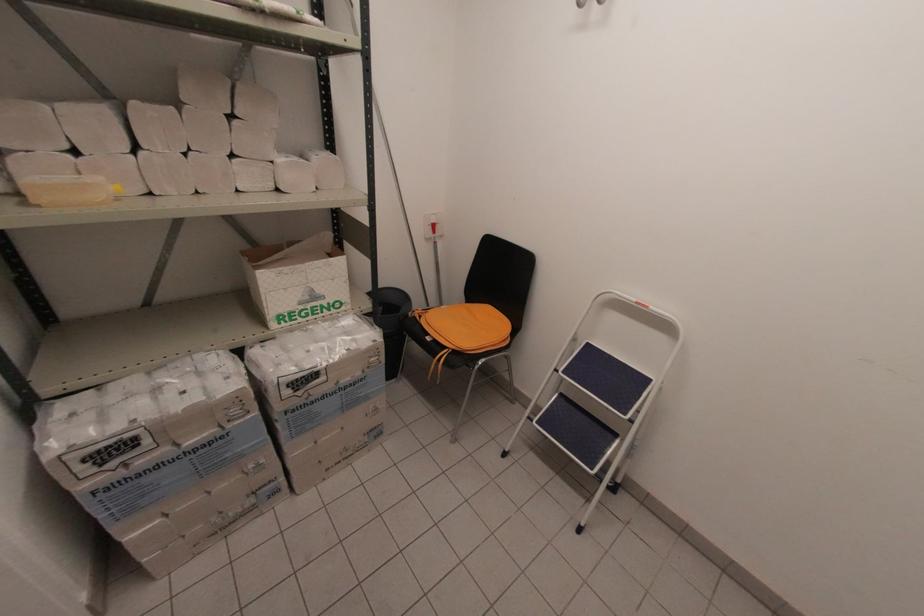
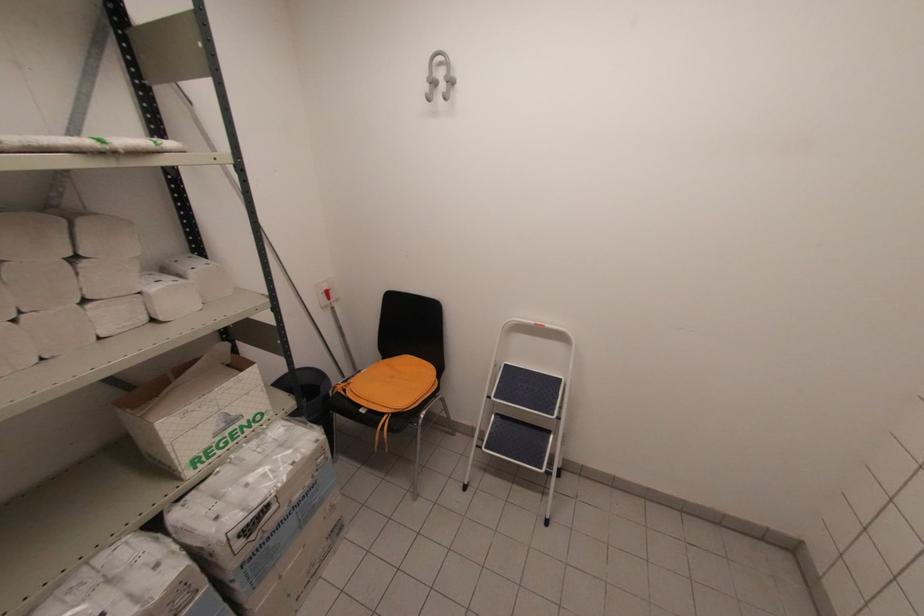
Where in the second image is the point corresponding to (444,307) from the first image?

(362, 371)